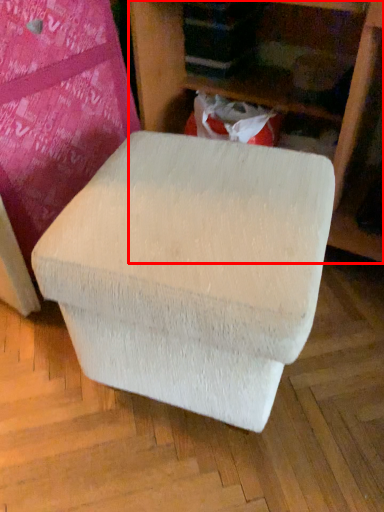
Question: From the image's perspective, considering the relative positions of furniture (annotated by the red box) and bean bag chair in the image provided, where is furniture (annotated by the red box) located with respect to the staircase?

Choices:
 (A) above
 (B) below

Answer: (A)